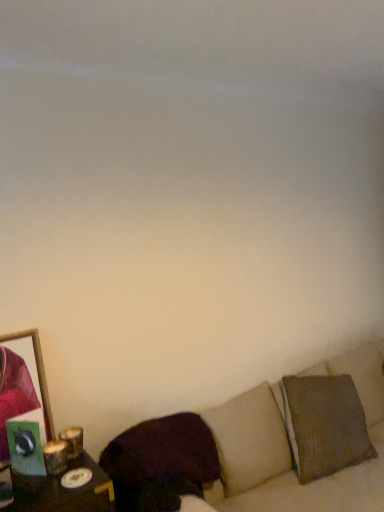
Question: Is textured beige couch at lower right in front of or behind wooden frame at left in the image?

Choices:
 (A) front
 (B) behind

Answer: (A)

Question: From the image's perspective, is textured beige couch at lower right positioned above or below wooden frame at left?

Choices:
 (A) above
 (B) below

Answer: (B)

Question: Which is farther from the dark brown fabric pillow at lower center?

Choices:
 (A) wooden frame at left
 (B) textured beige couch at lower right

Answer: (A)

Question: Which object is the farthest from the textured beige couch at lower right?

Choices:
 (A) dark brown fabric pillow at lower center
 (B) wooden frame at left

Answer: (B)